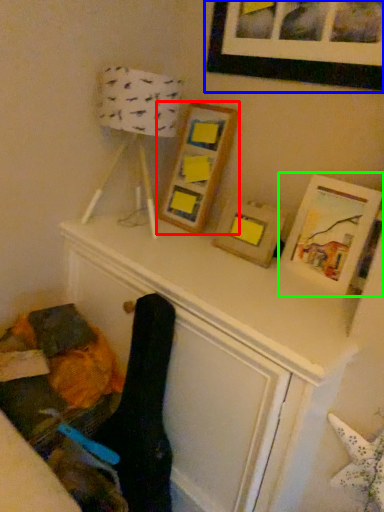
Question: Which object is the closest to the picture frame (highlighted by a red box)? Choose among these: picture frame (highlighted by a blue box) or picture frame (highlighted by a green box).

Choices:
 (A) picture frame
 (B) picture frame

Answer: (A)